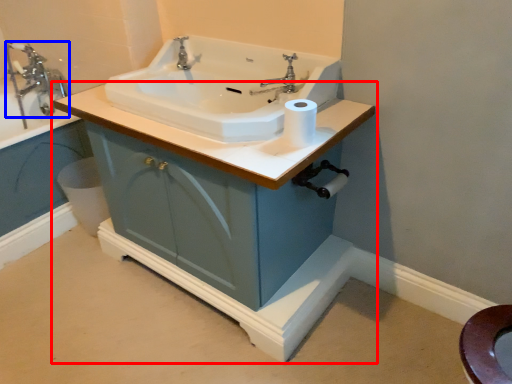
Question: Which object appears farthest to the camera in this image, bathroom cabinet (highlighted by a red box) or tap (highlighted by a blue box)?

Choices:
 (A) bathroom cabinet
 (B) tap

Answer: (B)